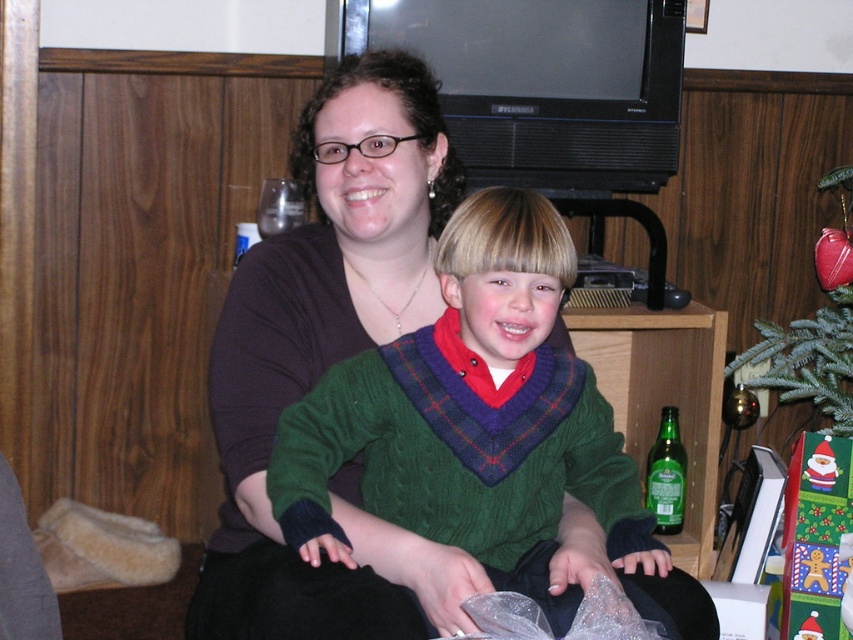
From the picture: You are a photographer standing 5 feet away from the camera. You want to adjust the focus to capture the green knitted sweater at center clearly. Can you reach the camera from your current position to make the adjustment?

The distance between the green knitted sweater at center and the camera is 3.61 feet. Since you are 5 feet away from the camera, you are farther than the sweater from the camera. To reach the camera, you need to move closer by 1.39 feet.

You are a photographer trying to capture a closeup of the green knitted sweater at center. You are currently positioned at point (469, 412). Can you take the closeup from your current position?

Yes, because the point (469, 412) is on the green knitted sweater at center, so you can take the closeup from there.

You are an interior designer planning to hang a picture frame above the green knitted sweater at center and the green matte christmas tree at lower right. Based on their positions, where should the frame be placed?

The green knitted sweater at center is located below the green matte christmas tree at lower right, so the picture frame should be placed above the green matte christmas tree at lower right to be positioned correctly between them.